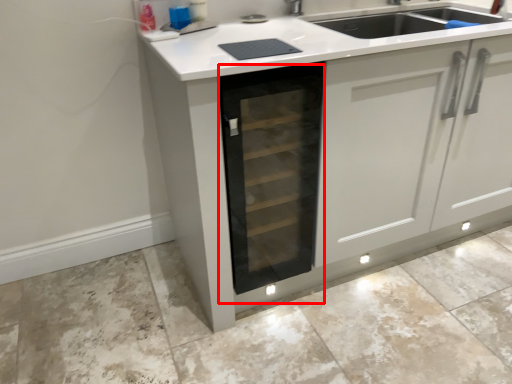
Question: From the image's perspective, what is the correct spatial relationship of oven (annotated by the red box) in relation to granite?

Choices:
 (A) below
 (B) above

Answer: (B)